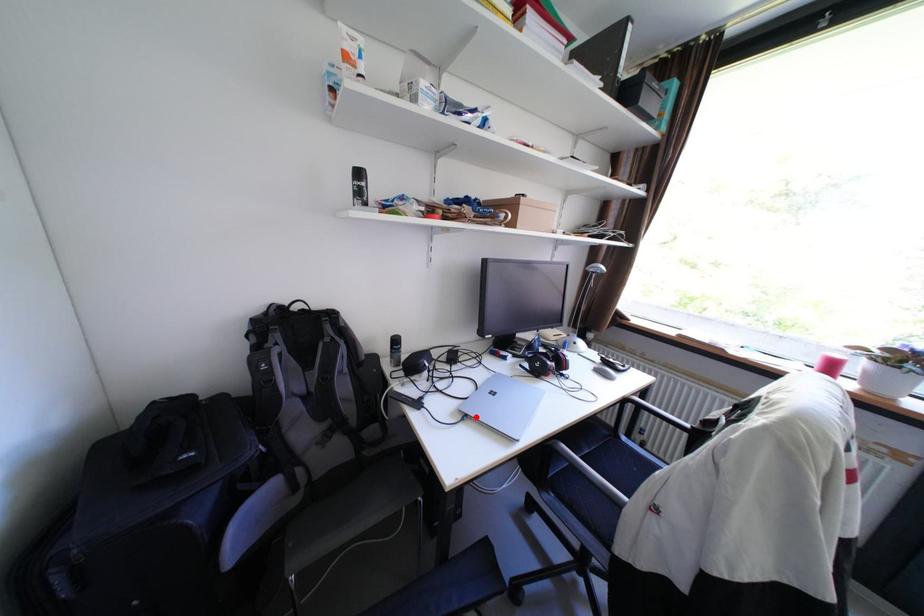
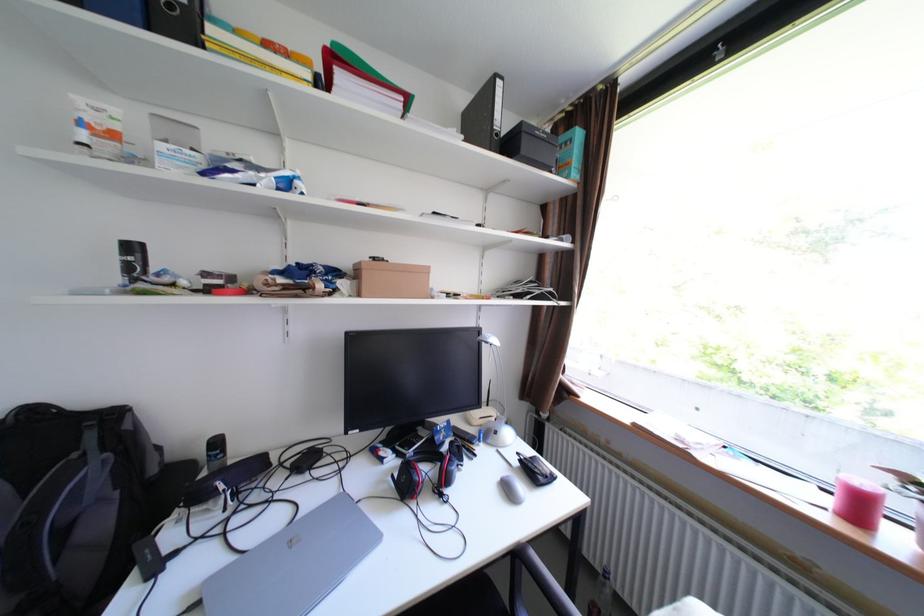
Where in the second image is the point corresponding to the highlighted location from the first image?

(208, 604)